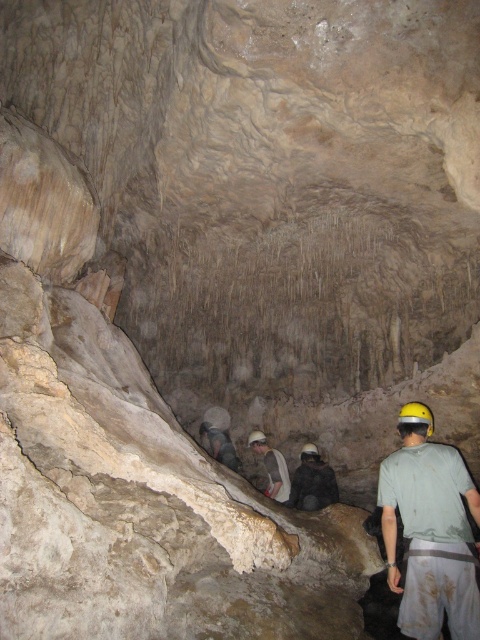
You are a caver preparing to enter a narrow cave passage. You notice two hard hats in the center of the image, a yellow hard hat at center and a white hard hat at center. Which hard hat is covering the other one?

The yellow hard hat at center is positioned over white hard hat at center, so it is covering the white one.

You are a caver with a 2.5 meter long measuring tape. You want to measure the distance between yourself and the dark gray fabric construction worker at center. Can you do it with your tape?

The dark gray fabric construction worker at center and camera are 6.68 meters apart from each other. Since your tape is only 2.5 meters long, you cannot measure the full distance between yourself and the dark gray fabric construction worker at center.